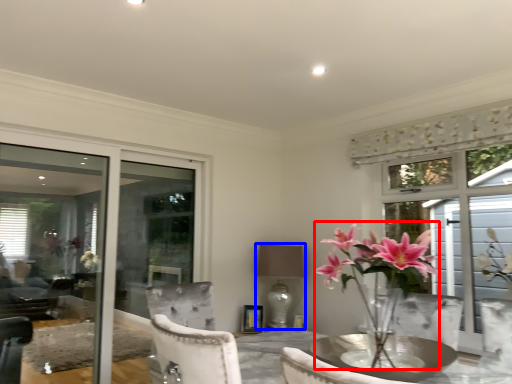
Question: Among these objects, which one is farthest to the camera, floral arrangement (highlighted by a red box) or lamp (highlighted by a blue box)?

Choices:
 (A) floral arrangement
 (B) lamp

Answer: (B)